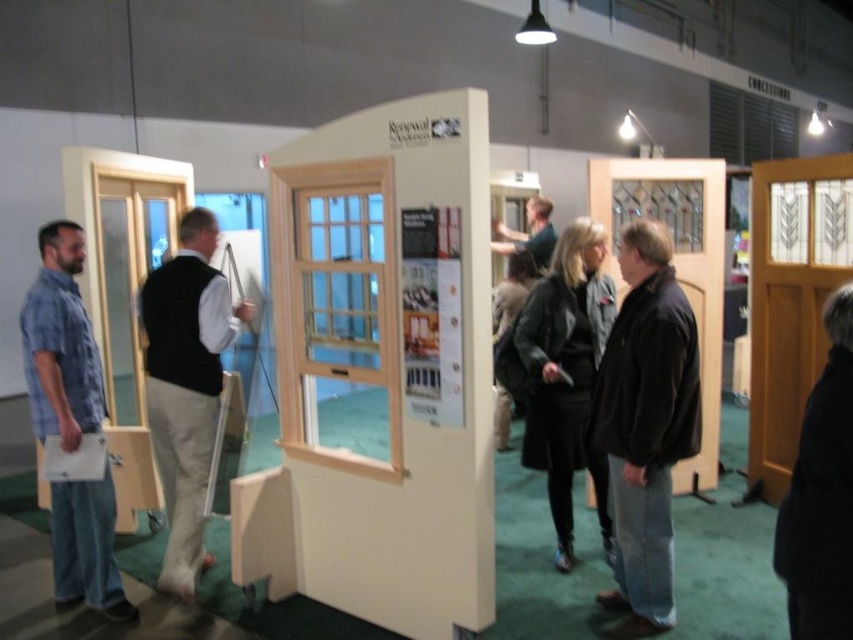
You are a customer in the showroom and want to read the information on the poster attached to the white wood door at center. However, the dark brown leather jacket at center is blocking your view. Can you move the jacket to see the poster?

The white wood door at center is in front of the dark brown leather jacket at center, meaning the jacket is behind the door. Since the door is already positioned in front, you don not need to move the jacket to see the poster on the door.

Based on the photo, you are a delivery person who needs to deliver a package to the white wood door at center. Your cart is 1.8 meters long. Can you maneuver your cart to the door without moving the display stand?

The distance between you and the white wood door at center is 2.46 meters. Since your cart is 1.8 meters long, you have enough space to maneuver the cart to the door without needing to move the display stand.

You are a fashion designer observing the indoor showroom scene. You see the brown leather jacket at center and the dark blue shirt at center. Which clothing item is bigger in size?

The brown leather jacket at center has a larger size compared to the dark blue shirt at center.